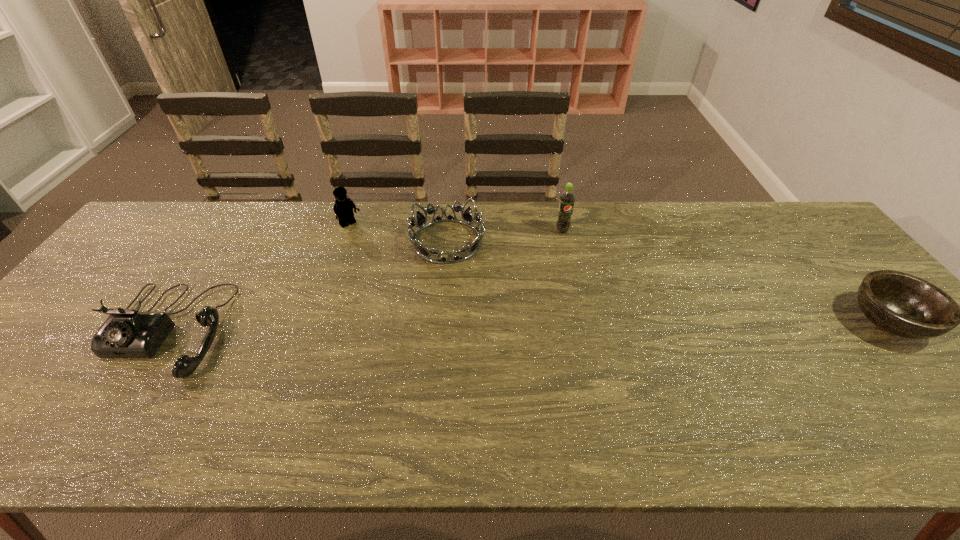
At what (x,y) coordinates should I click in order to perform the action: click on object that is at the left edge. Please return your answer as a coordinate pair (x, y). This screenshot has width=960, height=540. Looking at the image, I should click on (127, 333).

Image resolution: width=960 pixels, height=540 pixels. I want to click on object located at the right edge, so click(904, 305).

Where is `object that is at the near left corner`? object that is at the near left corner is located at coordinates (127, 333).

At what (x,y) coordinates should I click in order to perform the action: click on vacant region at the far edge. Please return your answer as a coordinate pair (x, y). This screenshot has height=540, width=960. Looking at the image, I should click on (400, 225).

Find the location of a particular element. This screenshot has height=540, width=960. free space at the near edge is located at coordinates (611, 379).

This screenshot has height=540, width=960. Find the location of `free space at the far left corner`. free space at the far left corner is located at coordinates (179, 237).

In the image, there is a desktop. Identify the location of vacant space at the near left corner. (25, 403).

At what (x,y) coordinates should I click in order to perform the action: click on vacant region between the third object from right to left and the Lego. Please return your answer as a coordinate pair (x, y). Image resolution: width=960 pixels, height=540 pixels. Looking at the image, I should click on (398, 233).

Where is `vacant point located between the tiara and the Lego`? vacant point located between the tiara and the Lego is located at coordinates (398, 233).

I want to click on unoccupied area between the third object from right to left and the leftmost object, so click(x=307, y=286).